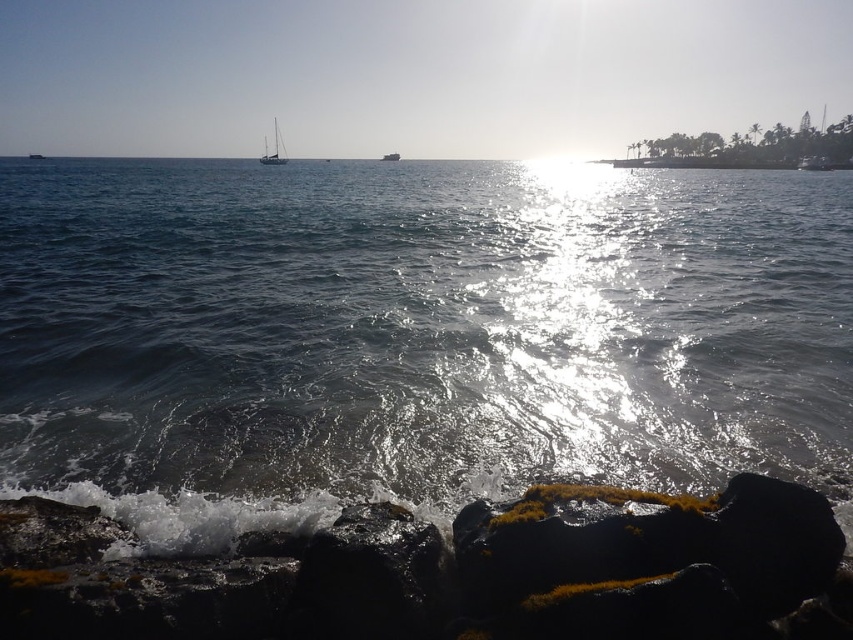
Question: Does smooth black rock at lower left appear under white glossy sailboat at upper center?

Choices:
 (A) yes
 (B) no

Answer: (A)

Question: Which of these objects is positioned farthest from the glistening water at center?

Choices:
 (A) metallic silver boat at center
 (B) white glossy sailboat at upper center

Answer: (A)

Question: Is glistening water at center smaller than white glossy sailboat at upper center?

Choices:
 (A) yes
 (B) no

Answer: (A)

Question: Which point is closer to the camera?

Choices:
 (A) (267, 150)
 (B) (555, 304)
 (C) (380, 157)

Answer: (B)

Question: Based on their relative distances, which object is farther from the metallic silver boat at center?

Choices:
 (A) smooth black rock at lower left
 (B) glistening water at center

Answer: (A)

Question: Does smooth black rock at lower left appear on the left side of metallic silver boat at center?

Choices:
 (A) yes
 (B) no

Answer: (B)